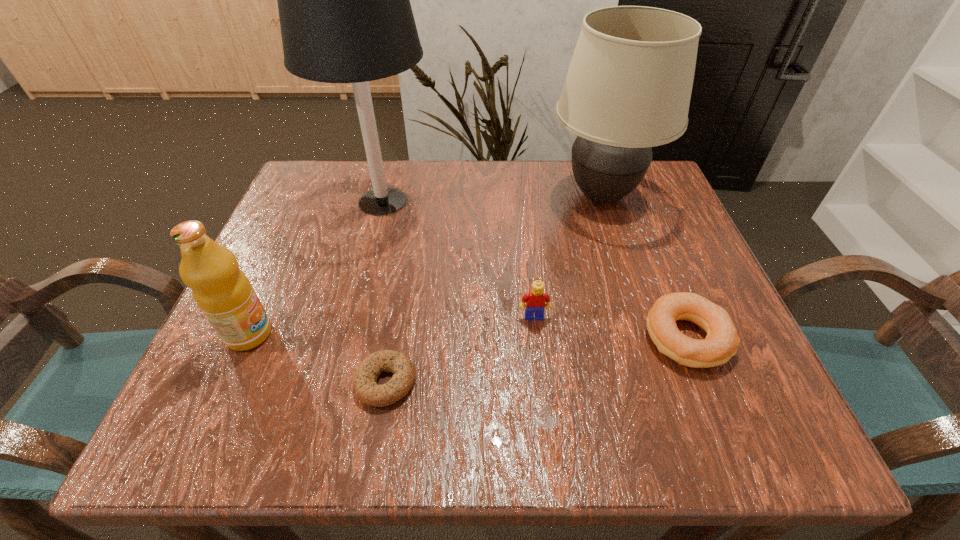
Where is `fruit juice that is positioned at the left edge`? The image size is (960, 540). fruit juice that is positioned at the left edge is located at coordinates (222, 291).

This screenshot has width=960, height=540. I want to click on lampshade located at the right edge, so click(628, 88).

Find the location of `bagel that is at the right edge`. bagel that is at the right edge is located at coordinates (722, 341).

I want to click on object present at the far left corner, so click(344, 6).

The height and width of the screenshot is (540, 960). What are the coordinates of `object at the far right corner` in the screenshot? It's located at (628, 88).

Find the location of a particular element. Image resolution: width=960 pixels, height=540 pixels. blank area at the far edge is located at coordinates (432, 208).

In the image, there is a desktop. Find the location of `free space at the near edge`. free space at the near edge is located at coordinates (671, 448).

Identify the location of free space at the left edge. (318, 336).

I want to click on vacant space at the right edge of the desktop, so click(706, 374).

Find the location of `vacant space at the far left corner of the desktop`. vacant space at the far left corner of the desktop is located at coordinates (348, 196).